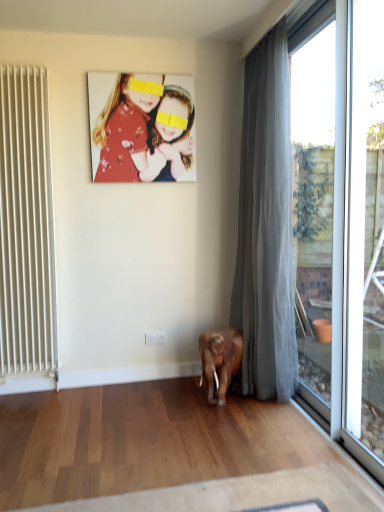
Question: Is the position of gray sheer curtain at right more distant than that of white matte radiator at left?

Choices:
 (A) yes
 (B) no

Answer: (B)

Question: Can you confirm if gray sheer curtain at right is bigger than white matte radiator at left?

Choices:
 (A) no
 (B) yes

Answer: (B)

Question: Considering the relative positions of gray sheer curtain at right and white matte radiator at left in the image provided, is gray sheer curtain at right to the left of white matte radiator at left from the viewer's perspective?

Choices:
 (A) no
 (B) yes

Answer: (A)

Question: Is white matte radiator at left a part of gray sheer curtain at right?

Choices:
 (A) no
 (B) yes

Answer: (A)

Question: From the image's perspective, is gray sheer curtain at right over white matte radiator at left?

Choices:
 (A) yes
 (B) no

Answer: (A)

Question: Is point coord(324,420) closer or farther from the camera than point coord(375,206)?

Choices:
 (A) farther
 (B) closer

Answer: (A)

Question: In the image, is transparent glass window at right, which is the second window frame in front-to-back order, positioned in front of or behind white plastic window frame at right, which is the first window frame from front to back?

Choices:
 (A) behind
 (B) front

Answer: (A)

Question: From a real-world perspective, is transparent glass window at right, acting as the 1th window frame starting from the back, positioned above or below white plastic window frame at right, which appears as the 2th window frame when viewed from the back?

Choices:
 (A) below
 (B) above

Answer: (B)

Question: From the image's perspective, is transparent glass window at right, which is the second window frame in front-to-back order, located above or below white plastic window frame at right, which is the first window frame from front to back?

Choices:
 (A) above
 (B) below

Answer: (A)

Question: In terms of height, does white plastic power outlet at lower center look taller or shorter compared to transparent glass window at right, which is the second window frame in front-to-back order?

Choices:
 (A) short
 (B) tall

Answer: (A)

Question: Is white plastic power outlet at lower center wider or thinner than transparent glass window at right, which is the second window frame in front-to-back order?

Choices:
 (A) wide
 (B) thin

Answer: (B)

Question: Is point (145, 335) closer or farther from the camera than point (296, 327)?

Choices:
 (A) closer
 (B) farther

Answer: (B)

Question: From the image's perspective, is white plastic power outlet at lower center above or below transparent glass window at right, which is the second window frame in front-to-back order?

Choices:
 (A) below
 (B) above

Answer: (A)

Question: In the image, is floral fabric photo at upper center on the left side or the right side of white plastic window frame at right, which is the first window frame from front to back?

Choices:
 (A) left
 (B) right

Answer: (A)

Question: Considering the positions of floral fabric photo at upper center and white plastic window frame at right, which appears as the 2th window frame when viewed from the back, in the image, is floral fabric photo at upper center taller or shorter than white plastic window frame at right, which appears as the 2th window frame when viewed from the back,?

Choices:
 (A) tall
 (B) short

Answer: (B)